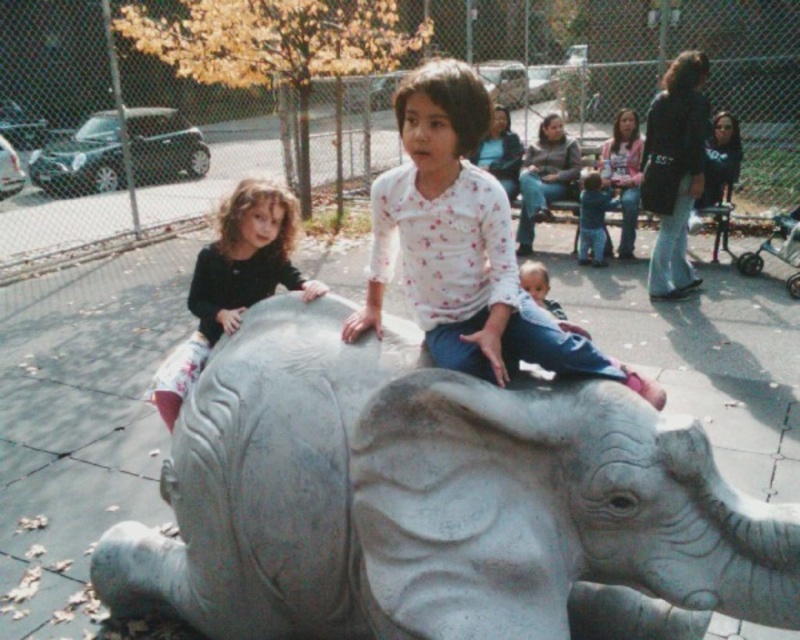
You are a photographer trying to capture a photo of both the gray stone elephant at center and the dark brown hair at left. Since you want both subjects to appear clearly in the frame, which object should you focus on first to ensure proper depth of field?

The gray stone elephant at center is larger in size than the dark brown hair at left, so focusing on the larger object first will help ensure both are in focus.

You are a photographer standing at the entrance of the playground. You want to take a photo of the gray stone elephant at center and the dark brown hair at left. Based on their positions, which object should appear larger in the photo?

The gray stone elephant at center is closer to the viewer than the dark brown hair at left, so it should appear larger in the photo.

You are a photographer trying to capture a photo of the gray stone elephant at center and the dark brown hair at left. To ensure both subjects are in focus, you need to know which one is taller. Can you determine which is taller?

The gray stone elephant at center has a greater height compared to the dark brown hair at left, so the gray stone elephant at center is taller.